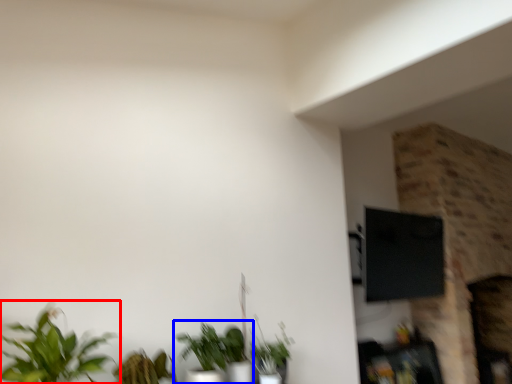
Question: Which object appears farthest to the camera in this image, houseplant (highlighted by a red box) or houseplant (highlighted by a blue box)?

Choices:
 (A) houseplant
 (B) houseplant

Answer: (B)